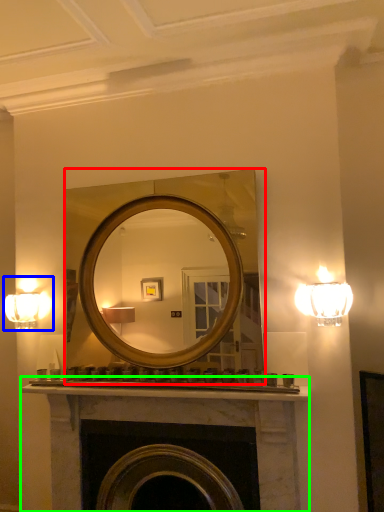
Question: Estimate the real-world distances between objects in this image. Which object is closer to mirror (highlighted by a red box), fixture (highlighted by a blue box) or fireplace (highlighted by a green box)?

Choices:
 (A) fixture
 (B) fireplace

Answer: (A)